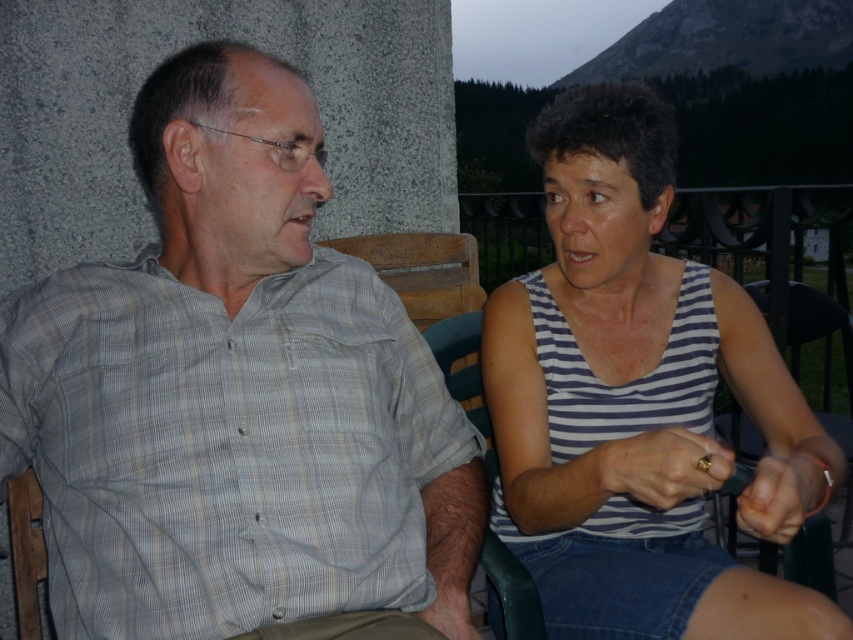
Which is below, gray plaid shirt at left or striped fabric tank top at right?

striped fabric tank top at right is lower down.

Does point (251, 509) come farther from viewer compared to point (637, 570)?

No, (251, 509) is in front of (637, 570).

Identify the location of gray plaid shirt at left. This screenshot has width=853, height=640. (235, 394).

Locate an element on the screen. gray plaid shirt at left is located at coordinates (235, 394).